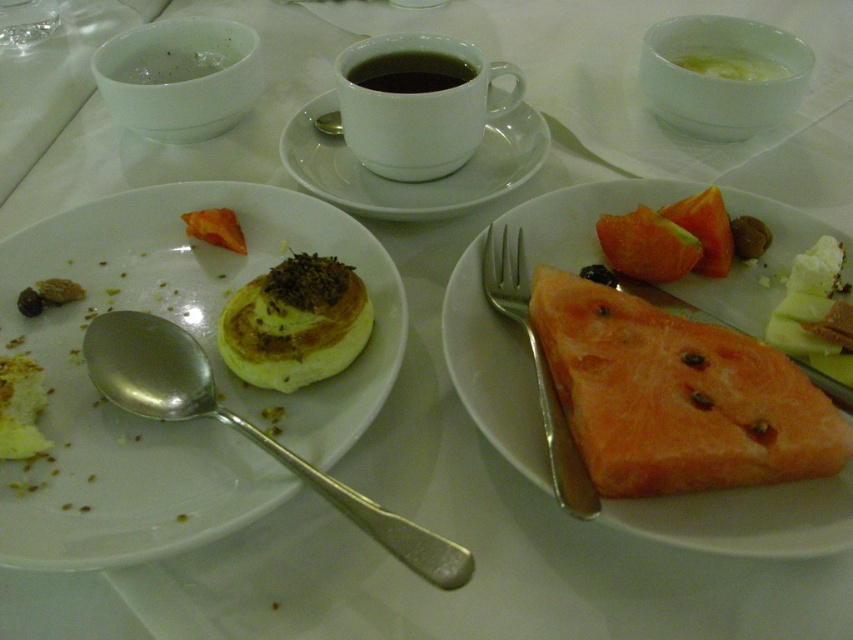
This screenshot has width=853, height=640. I want to click on white glossy plate at left, so click(212, 365).

Which is above, white glossy plate at left or black matte cup at center?

black matte cup at center is higher up.

The width and height of the screenshot is (853, 640). Describe the element at coordinates (212, 365) in the screenshot. I see `white glossy plate at left` at that location.

Locate an element on the screen. This screenshot has height=640, width=853. white glossy plate at left is located at coordinates (212, 365).

Which is behind, point (305, 198) or point (415, 557)?

Positioned behind is point (305, 198).

Does white glossy plate at left appear under silver metallic spoon at left?

No, white glossy plate at left is not below silver metallic spoon at left.

Is point (64, 413) closer to viewer compared to point (119, 344)?

Yes.

You are a GUI agent. You are given a task and a screenshot of the screen. Output one action in this format:
    pyautogui.click(x=<x>, y=<y>)
    Task: Click on the white glossy plate at left
    The height and width of the screenshot is (640, 853).
    Given the screenshot: What is the action you would take?
    pyautogui.click(x=212, y=365)

Is point (357, 515) more distant than point (323, 120)?

No, it is not.

The height and width of the screenshot is (640, 853). Describe the element at coordinates (241, 428) in the screenshot. I see `silver metallic spoon at left` at that location.

Which is in front, point (195, 376) or point (318, 125)?

Point (195, 376) is in front.

This screenshot has width=853, height=640. Identify the location of silver metallic spoon at left. (241, 428).